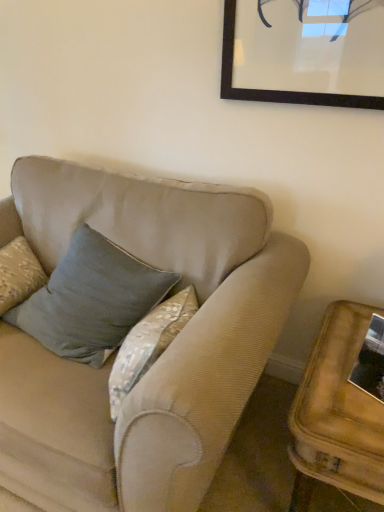
In order to click on free point above wooden side table at lower right (from a real-world perspective) in this screenshot , I will do `click(342, 371)`.